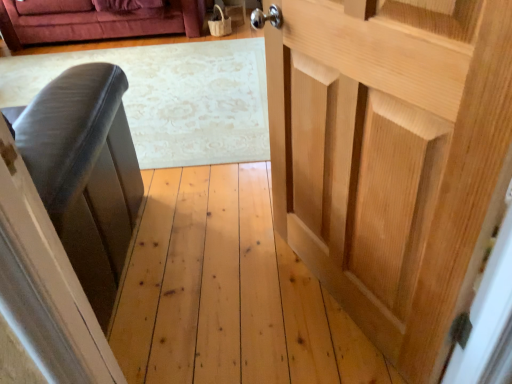
The height and width of the screenshot is (384, 512). What do you see at coordinates (85, 173) in the screenshot?
I see `velvet grey armchair at left` at bounding box center [85, 173].

Where is `velvet grey armchair at left`? Image resolution: width=512 pixels, height=384 pixels. velvet grey armchair at left is located at coordinates (85, 173).

What is the approximate height of natural wood door at right?

natural wood door at right is 37.49 inches tall.

Find the location of a particular element. This screenshot has height=384, width=512. natural wood door at right is located at coordinates (392, 157).

Describe the element at coordinates (392, 157) in the screenshot. I see `natural wood door at right` at that location.

You are a GUI agent. You are given a task and a screenshot of the screen. Output one action in this format:
    pyautogui.click(x=<x>, y=<y>)
    Task: Click on the velvet grey armchair at left
    The height and width of the screenshot is (384, 512).
    Given the screenshot: What is the action you would take?
    pyautogui.click(x=85, y=173)

Can you confirm if natural wood door at right is positioned to the right of velvet grey armchair at left?

Yes.

Which object is more forward, natural wood door at right or velvet grey armchair at left?

natural wood door at right.

Does point (292, 84) appear closer or farther from the camera than point (95, 142)?

Point (292, 84) is farther from the camera than point (95, 142).

From the image's perspective, would you say natural wood door at right is shown under velvet grey armchair at left?

Yes, from the image's perspective, natural wood door at right is below velvet grey armchair at left.

From a real-world perspective, is natural wood door at right positioned above or below velvet grey armchair at left?

Clearly, from a real-world perspective, natural wood door at right is above velvet grey armchair at left.

Considering the relative sizes of natural wood door at right and velvet grey armchair at left in the image provided, is natural wood door at right wider than velvet grey armchair at left?

Incorrect, the width of natural wood door at right does not surpass that of velvet grey armchair at left.

Can you confirm if natural wood door at right is shorter than velvet grey armchair at left?

Correct, natural wood door at right is not as tall as velvet grey armchair at left.

In terms of size, does natural wood door at right appear bigger or smaller than velvet grey armchair at left?

natural wood door at right is smaller than velvet grey armchair at left.

Would you say natural wood door at right contains velvet grey armchair at left?

No, velvet grey armchair at left is located outside of natural wood door at right.

Is there a large distance between natural wood door at right and velvet grey armchair at left?

No, natural wood door at right is in close proximity to velvet grey armchair at left.

From the picture: Is natural wood door at right facing towards velvet grey armchair at left?

No.

How different are the orientations of natural wood door at right and velvet grey armchair at left in degrees?

There is a 66-degree angle between the facing directions of natural wood door at right and velvet grey armchair at left.

You are a GUI agent. You are given a task and a screenshot of the screen. Output one action in this format:
    pyautogui.click(x=<x>, y=<y>)
    Task: Click on the furniture that appears above the natural wood door at right (from the image's perspective)
    This screenshot has height=384, width=512.
    Given the screenshot: What is the action you would take?
    85,173

In the scene shown: Is velvet grey armchair at left to the right of natural wood door at right from the viewer's perspective?

In fact, velvet grey armchair at left is to the left of natural wood door at right.

Which object is further away from the camera taking this photo, velvet grey armchair at left or natural wood door at right?

velvet grey armchair at left.

Is point (132, 146) positioned after point (416, 276)?

Yes, point (132, 146) is behind point (416, 276).

In the scene shown: From the image's perspective, relative to natural wood door at right, is velvet grey armchair at left above or below?

velvet grey armchair at left is situated higher than natural wood door at right in the image.

From a real-world perspective, who is located higher, velvet grey armchair at left or natural wood door at right?

In real-world perspective, natural wood door at right is above.

In the scene shown: Considering the relative sizes of velvet grey armchair at left and natural wood door at right in the image provided, is velvet grey armchair at left wider than natural wood door at right?

Yes.

Can you confirm if velvet grey armchair at left is taller than natural wood door at right?

Yes.

Is velvet grey armchair at left bigger or smaller than natural wood door at right?

Clearly, velvet grey armchair at left is larger in size than natural wood door at right.

Which is correct: velvet grey armchair at left is inside natural wood door at right, or outside of it?

velvet grey armchair at left exists outside the volume of natural wood door at right.

Is velvet grey armchair at left next to natural wood door at right?

No, velvet grey armchair at left is not touching natural wood door at right.

Is natural wood door at right at the back of velvet grey armchair at left?

No, velvet grey armchair at left is not facing away from natural wood door at right.

What's the angular difference between velvet grey armchair at left and natural wood door at right's facing directions?

66 degrees.

Image resolution: width=512 pixels, height=384 pixels. Find the location of `door that is on the right side of velvet grey armchair at left`. door that is on the right side of velvet grey armchair at left is located at coordinates (392, 157).

Image resolution: width=512 pixels, height=384 pixels. I want to click on door lying on the right of velvet grey armchair at left, so click(x=392, y=157).

Where is `furniture beneath the natural wood door at right (from a real-world perspective)`? furniture beneath the natural wood door at right (from a real-world perspective) is located at coordinates tap(85, 173).